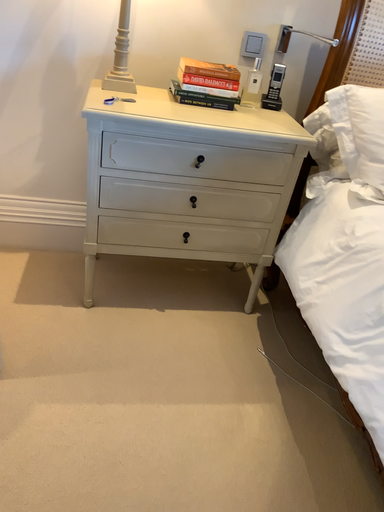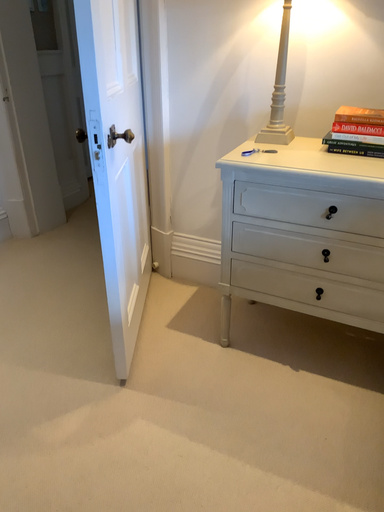
Question: Which way did the camera rotate in the video?

Choices:
 (A) rotated upward
 (B) rotated downward

Answer: (A)